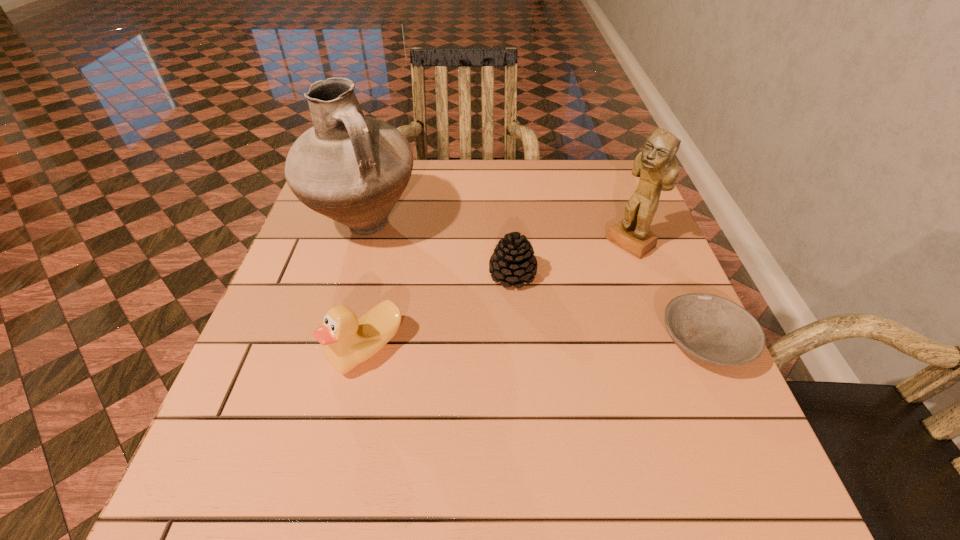
At what (x,y) coordinates should I click in order to perform the action: click on blank space located 0.120m on the handle side of the pitcher. Please return your answer as a coordinate pair (x, y). Looking at the image, I should click on (438, 272).

At what (x,y) coordinates should I click in order to perform the action: click on free location located on the handle side of the pitcher. Please return your answer as a coordinate pair (x, y). The width and height of the screenshot is (960, 540). Looking at the image, I should click on (438, 272).

What are the coordinates of `free space located at the narrow end of the pinecone` in the screenshot? It's located at click(577, 424).

Find the location of a particular element. The image size is (960, 540). blank space located at the narrow end of the pinecone is located at coordinates (582, 435).

The width and height of the screenshot is (960, 540). I want to click on vacant space located 0.140m at the narrow end of the pinecone, so click(x=541, y=342).

At what (x,y) coordinates should I click in order to perform the action: click on free space located on the front-facing side of the fourth shortest object. Please return your answer as a coordinate pair (x, y). The height and width of the screenshot is (540, 960). Looking at the image, I should click on (510, 340).

Locate an element on the screen. free region located 0.210m on the front-facing side of the fourth shortest object is located at coordinates (561, 299).

This screenshot has height=540, width=960. Find the location of `vacant position located 0.230m on the front-facing side of the fourth shortest object`. vacant position located 0.230m on the front-facing side of the fourth shortest object is located at coordinates point(555,304).

This screenshot has width=960, height=540. What are the coordinates of `object that is at the far edge` in the screenshot? It's located at (351, 168).

Find the location of a particular element. This screenshot has width=960, height=540. duck that is at the left edge is located at coordinates (348, 341).